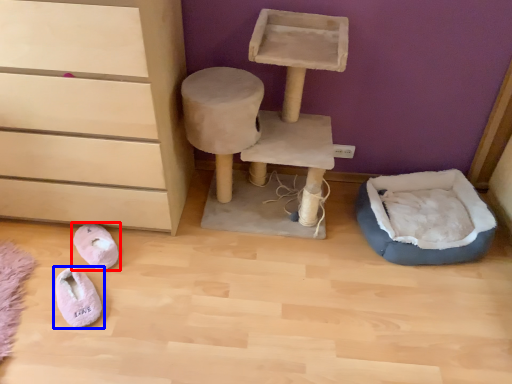
Question: Among these objects, which one is nearest to the camera, footwear (highlighted by a red box) or footwear (highlighted by a blue box)?

Choices:
 (A) footwear
 (B) footwear

Answer: (B)